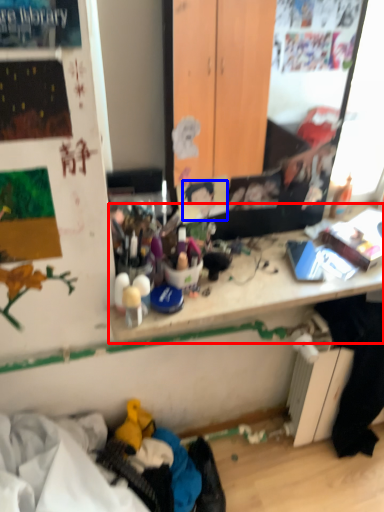
Question: Among these objects, which one is farthest to the camera, writing desk (highlighted by a red box) or person (highlighted by a blue box)?

Choices:
 (A) writing desk
 (B) person

Answer: (B)